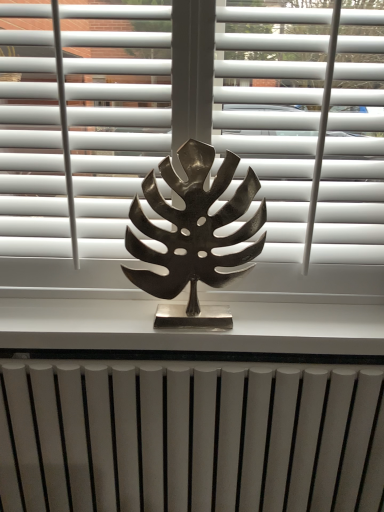
The height and width of the screenshot is (512, 384). I want to click on free space to the left of bronze leaf at center, so click(101, 318).